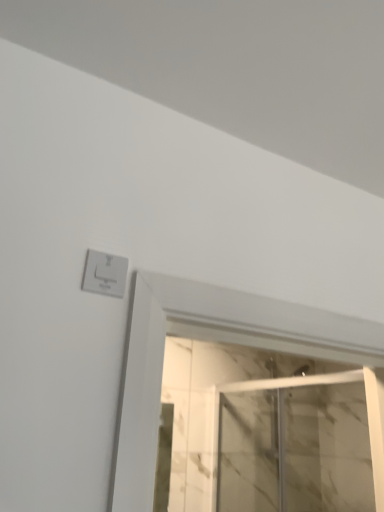
The width and height of the screenshot is (384, 512). What do you see at coordinates (104, 274) in the screenshot?
I see `white plastic switch at upper left` at bounding box center [104, 274].

Measure the distance between white plastic switch at upper left and camera.

The depth of white plastic switch at upper left is 32.48 inches.

In order to click on white plastic switch at upper left in this screenshot , I will do `click(104, 274)`.

The height and width of the screenshot is (512, 384). I want to click on white plastic switch at upper left, so click(104, 274).